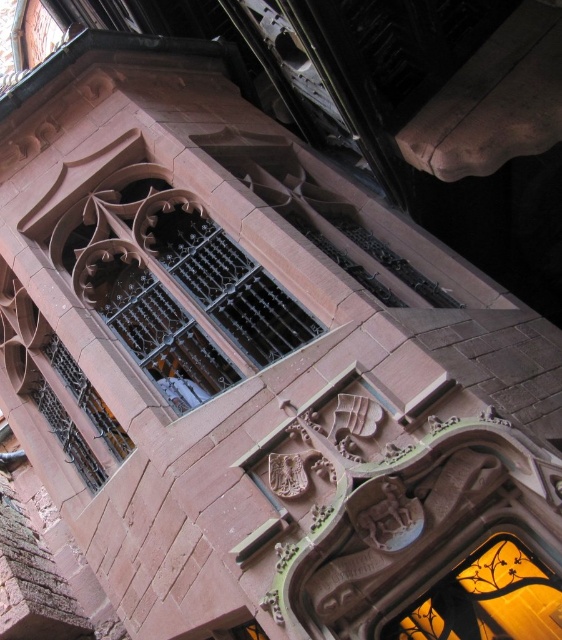
Question: Can you confirm if matte black metal window at center is positioned to the right of translucent stained glass window at center?

Choices:
 (A) yes
 (B) no

Answer: (B)

Question: Which object appears closest to the camera in this image?

Choices:
 (A) matte black metal window at center
 (B) translucent stained glass window at center

Answer: (B)

Question: Which point is closer to the camera taking this photo?

Choices:
 (A) (111, 177)
 (B) (436, 595)

Answer: (B)

Question: Does matte black metal window at center have a larger size compared to translucent stained glass window at center?

Choices:
 (A) no
 (B) yes

Answer: (B)

Question: Which object is farther from the camera taking this photo?

Choices:
 (A) translucent stained glass window at center
 (B) matte black metal window at center

Answer: (B)

Question: Does matte black metal window at center have a greater width compared to translucent stained glass window at center?

Choices:
 (A) no
 (B) yes

Answer: (B)